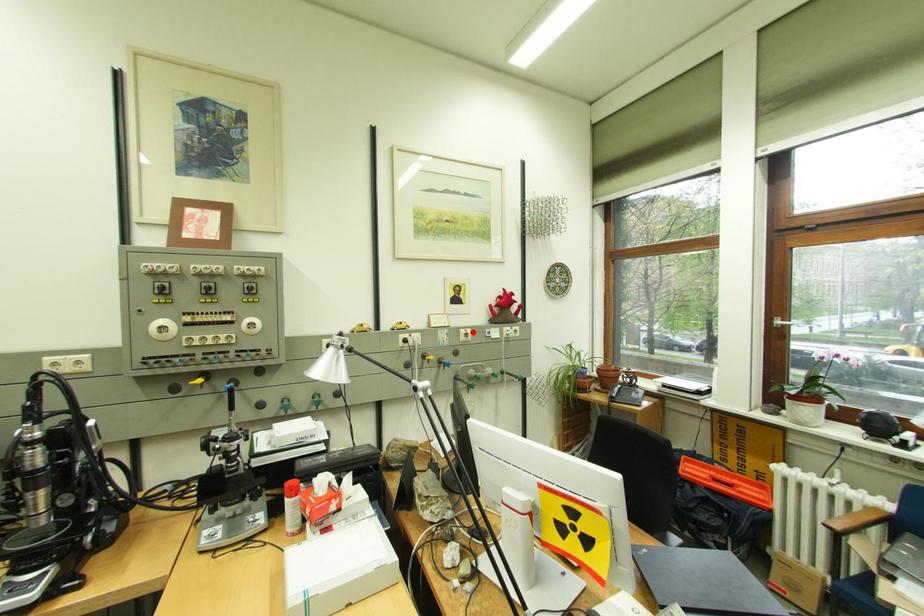
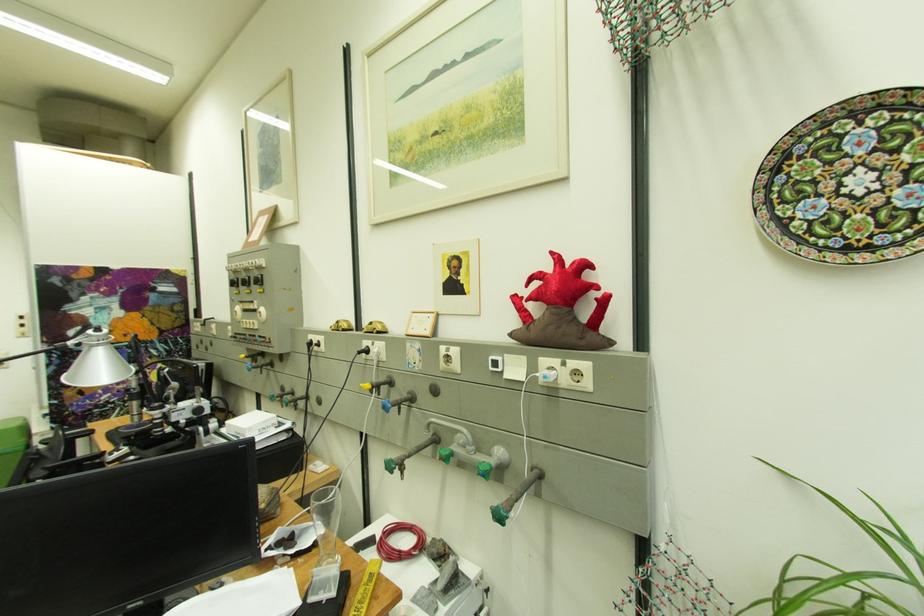
Locate, in the second image, the point that corresponds to the highlighted location in the first image.

(454, 351)